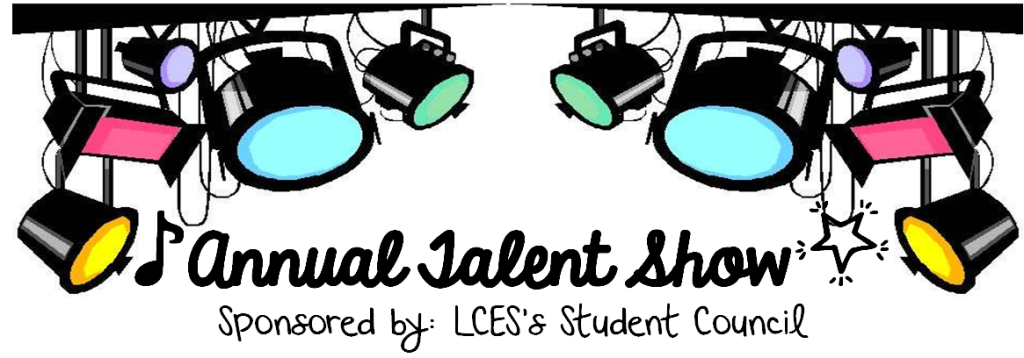
The height and width of the screenshot is (358, 1024). Find the location of `green light`. green light is located at coordinates (434, 100).